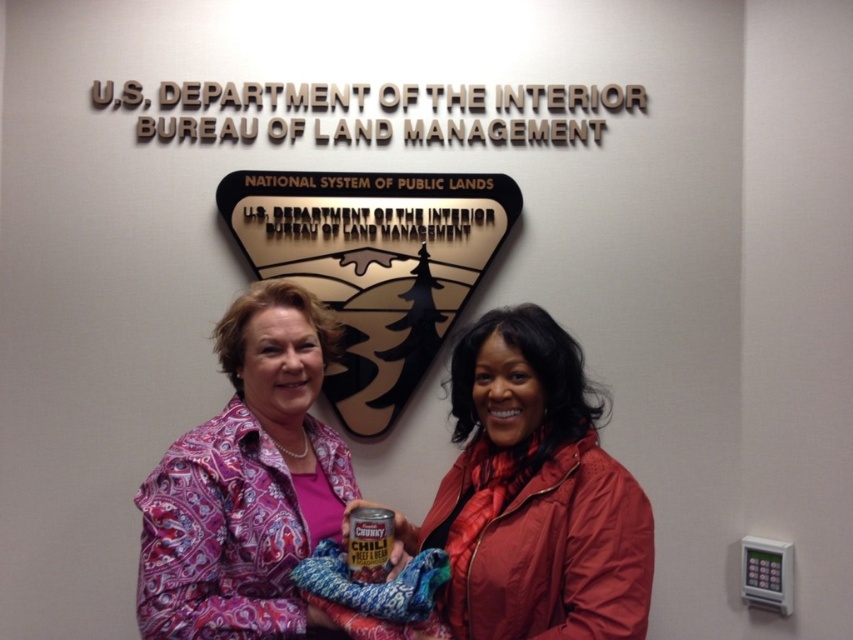
Can you confirm if red matte jacket at center is bigger than pink paisley shirt at center?

No.

Between red matte jacket at center and pink paisley shirt at center, which one appears on the right side from the viewer's perspective?

red matte jacket at center

Does point (468, 627) come farther from viewer compared to point (270, 618)?

Yes, it is behind point (270, 618).

You are a GUI agent. You are given a task and a screenshot of the screen. Output one action in this format:
    pyautogui.click(x=<x>, y=<y>)
    Task: Click on the red matte jacket at center
    The height and width of the screenshot is (640, 853).
    Given the screenshot: What is the action you would take?
    pyautogui.click(x=534, y=496)